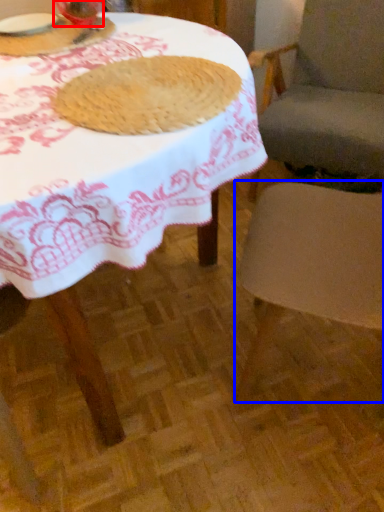
Question: Which of the following is the farthest to the observer, tableware (highlighted by a red box) or chair (highlighted by a blue box)?

Choices:
 (A) tableware
 (B) chair

Answer: (A)